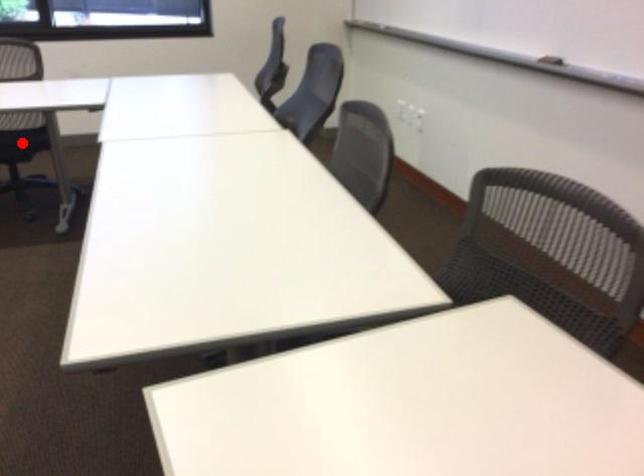
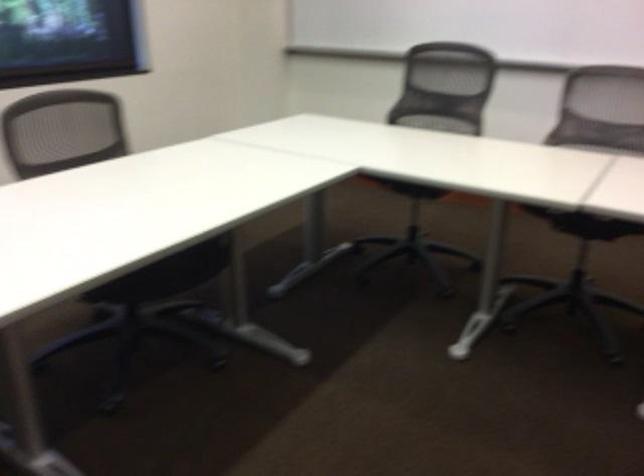
Question: I am providing you with two images of the same scene from different viewpoints. A red point is marked on the first image. Can you still see the location of the red point in image 2?

Choices:
 (A) Yes
 (B) No

Answer: (B)